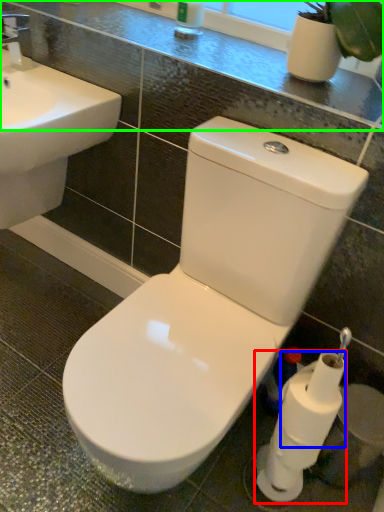
Question: Based on their relative distances, which object is farther from toilet paper (highlighted by a red box)? Choose from toilet paper (highlighted by a blue box) and counter top (highlighted by a green box).

Choices:
 (A) toilet paper
 (B) counter top

Answer: (B)